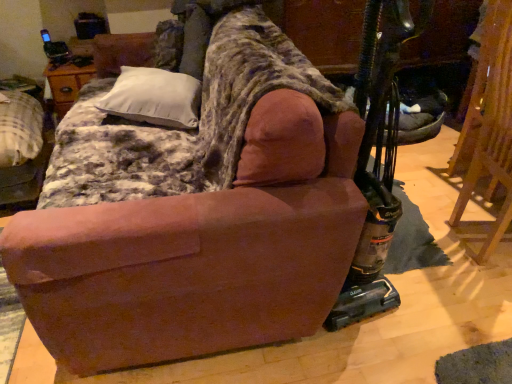
From the picture: In order to face wooden folding chair at right, should I rotate leftwards or rightwards?

You should rotate right by 33.358 degrees.

Describe the element at coordinates (488, 125) in the screenshot. I see `wooden folding chair at right` at that location.

Describe the element at coordinates (207, 231) in the screenshot. The image size is (512, 384). I see `brown suede couch at center` at that location.

Describe the element at coordinates (154, 98) in the screenshot. I see `white soft pillow at upper left` at that location.

At what (x,y) coordinates should I click in order to perform the action: click on wooden folding chair at right. Please return your answer as a coordinate pair (x, y). Looking at the image, I should click on (488, 125).

Can you confirm if velvet-like brown armchair at center-left is wider than white soft pillow at upper left?

In fact, velvet-like brown armchair at center-left might be narrower than white soft pillow at upper left.

Is velvet-like brown armchair at center-left completely or partially outside of white soft pillow at upper left?

Yes, velvet-like brown armchair at center-left is not within white soft pillow at upper left.

Is velvet-like brown armchair at center-left smaller than white soft pillow at upper left?

No.

Identify the location of pillow that appears above the velvet-like brown armchair at center-left (from the image's perspective). (154, 98).

Considering the positions of points (240, 146) and (120, 98), is point (240, 146) farther from camera compared to point (120, 98)?

No, it is in front of (120, 98).

Consider the image. From the image's perspective, relative to white soft pillow at upper left, is brown suede couch at center above or below?

Based on their image positions, brown suede couch at center is located beneath white soft pillow at upper left.

Which object is closer to the camera taking this photo, brown suede couch at center or white soft pillow at upper left?

brown suede couch at center is closer to the camera.

Between brown suede couch at center and white soft pillow at upper left, which one has larger width?

brown suede couch at center is wider.

What's the angular difference between wooden folding chair at right and brown suede couch at center's facing directions?

174 degrees separate the facing orientations of wooden folding chair at right and brown suede couch at center.

Is point (507, 144) farther from viewer compared to point (101, 320)?

Yes, it is behind point (101, 320).

Looking at this image, between wooden folding chair at right and brown suede couch at center, which one appears on the left side from the viewer's perspective?

brown suede couch at center.

Can you see wooden folding chair at right touching brown suede couch at center?

No, wooden folding chair at right is not beside brown suede couch at center.

The width and height of the screenshot is (512, 384). Find the location of `furniture that is on the left side of white soft pillow at upper left`. furniture that is on the left side of white soft pillow at upper left is located at coordinates (20, 148).

Considering the sizes of white soft pillow at upper left and velvet-like brown armchair at center-left in the image, is white soft pillow at upper left taller or shorter than velvet-like brown armchair at center-left?

Considering their sizes, white soft pillow at upper left has less height than velvet-like brown armchair at center-left.

Based on the photo, would you say white soft pillow at upper left is inside or outside velvet-like brown armchair at center-left?

white soft pillow at upper left is located beyond the bounds of velvet-like brown armchair at center-left.

Considering the positions of objects white soft pillow at upper left and velvet-like brown armchair at center-left in the image provided, who is behind, white soft pillow at upper left or velvet-like brown armchair at center-left?

velvet-like brown armchair at center-left.

Is wooden folding chair at right turned away from white soft pillow at upper left?

No, wooden folding chair at right is not facing away from white soft pillow at upper left.

From the image's perspective, relative to white soft pillow at upper left, is wooden folding chair at right above or below?

Based on their image positions, wooden folding chair at right is located beneath white soft pillow at upper left.

Are wooden folding chair at right and white soft pillow at upper left far apart?

Yes, wooden folding chair at right and white soft pillow at upper left are quite far apart.

Can you confirm if wooden folding chair at right is shorter than white soft pillow at upper left?

In fact, wooden folding chair at right may be taller than white soft pillow at upper left.

At what (x,y) coordinates should I click in order to perform the action: click on furniture lying behind the brown suede couch at center. Please return your answer as a coordinate pair (x, y). Image resolution: width=512 pixels, height=384 pixels. Looking at the image, I should click on (20, 148).

Can you see velvet-like brown armchair at center-left touching brown suede couch at center?

No, velvet-like brown armchair at center-left is not beside brown suede couch at center.

How different are the orientations of velvet-like brown armchair at center-left and brown suede couch at center in degrees?

The angular difference between velvet-like brown armchair at center-left and brown suede couch at center is 9.44 degrees.

Does point (35, 290) lie in front of point (6, 93)?

That is True.

Is velvet-like brown armchair at center-left located within brown suede couch at center?

That's incorrect, velvet-like brown armchair at center-left is not inside brown suede couch at center.

Can you confirm if brown suede couch at center is positioned to the left of velvet-like brown armchair at center-left?

No, brown suede couch at center is not to the left of velvet-like brown armchair at center-left.

Find the location of a particular element. Image resolution: width=512 pixels, height=384 pixels. studio couch on the right of velvet-like brown armchair at center-left is located at coordinates (207, 231).

Find the location of a particular element. furniture that appears below the white soft pillow at upper left (from a real-world perspective) is located at coordinates (20, 148).

This screenshot has height=384, width=512. Identify the location of pillow behind the brown suede couch at center. (154, 98).

Which object lies further to the anchor point brown suede couch at center, velvet-like brown armchair at center-left or wooden folding chair at right?

Among the two, velvet-like brown armchair at center-left is located further to brown suede couch at center.

Which object lies nearer to the anchor point white soft pillow at upper left, brown suede couch at center or wooden folding chair at right?

Among the two, brown suede couch at center is located nearer to white soft pillow at upper left.

Based on their spatial positions, is brown suede couch at center or white soft pillow at upper left closer to velvet-like brown armchair at center-left?

Among the two, white soft pillow at upper left is located nearer to velvet-like brown armchair at center-left.

When comparing their distances from brown suede couch at center, does velvet-like brown armchair at center-left or white soft pillow at upper left seem further?

Among the two, velvet-like brown armchair at center-left is located further to brown suede couch at center.

When comparing their distances from wooden folding chair at right, does brown suede couch at center or white soft pillow at upper left seem closer?

brown suede couch at center.

Estimate the real-world distances between objects in this image. Which object is further from white soft pillow at upper left, brown suede couch at center or velvet-like brown armchair at center-left?

velvet-like brown armchair at center-left lies further to white soft pillow at upper left than the other object.

From the image, which object appears to be nearer to wooden folding chair at right, brown suede couch at center or velvet-like brown armchair at center-left?

brown suede couch at center is positioned closer to the anchor wooden folding chair at right.

From the picture: Considering their positions, is wooden folding chair at right positioned closer to brown suede couch at center than velvet-like brown armchair at center-left?

wooden folding chair at right is closer to brown suede couch at center.

Image resolution: width=512 pixels, height=384 pixels. Identify the location of pillow located between velvet-like brown armchair at center-left and wooden folding chair at right in the left-right direction. (154, 98).

You are a GUI agent. You are given a task and a screenshot of the screen. Output one action in this format:
    pyautogui.click(x=<x>, y=<y>)
    Task: Click on the studio couch located between velvet-like brown armchair at center-left and wooden folding chair at right in the left-right direction
    
    Given the screenshot: What is the action you would take?
    pyautogui.click(x=207, y=231)

Find the location of a particular element. The width and height of the screenshot is (512, 384). studio couch located between white soft pillow at upper left and wooden folding chair at right in the left-right direction is located at coordinates (207, 231).

Image resolution: width=512 pixels, height=384 pixels. In order to click on pillow between velvet-like brown armchair at center-left and brown suede couch at center in this screenshot , I will do `click(154, 98)`.